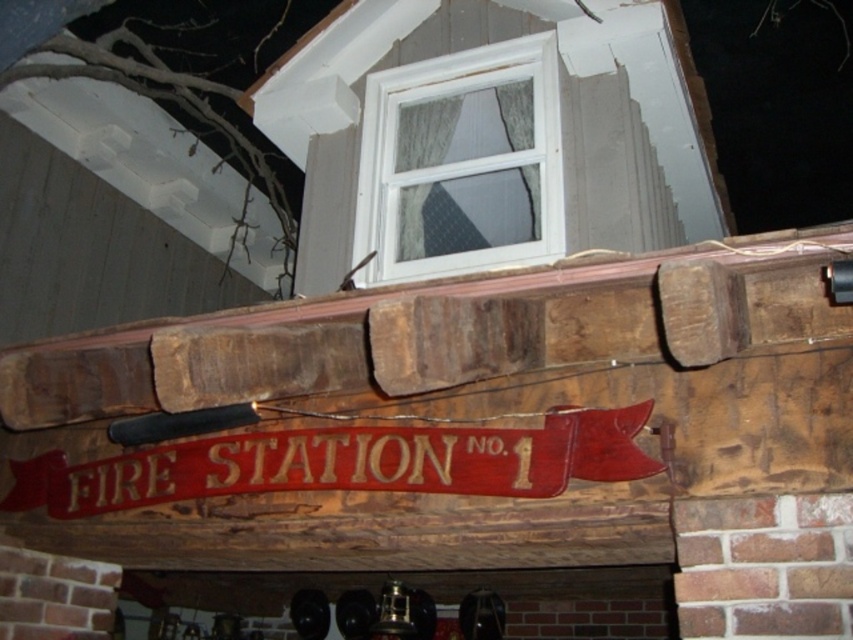
Which is below, rustic wood beam at center or white plastic window at upper center?

rustic wood beam at center

Who is more forward, (439,321) or (527,161)?

Point (439,321)

Is point (515, 291) closer to viewer compared to point (364, 132)?

Yes, it is in front of point (364, 132).

Where is `rustic wood beam at center`? Image resolution: width=853 pixels, height=640 pixels. rustic wood beam at center is located at coordinates pyautogui.click(x=436, y=333).